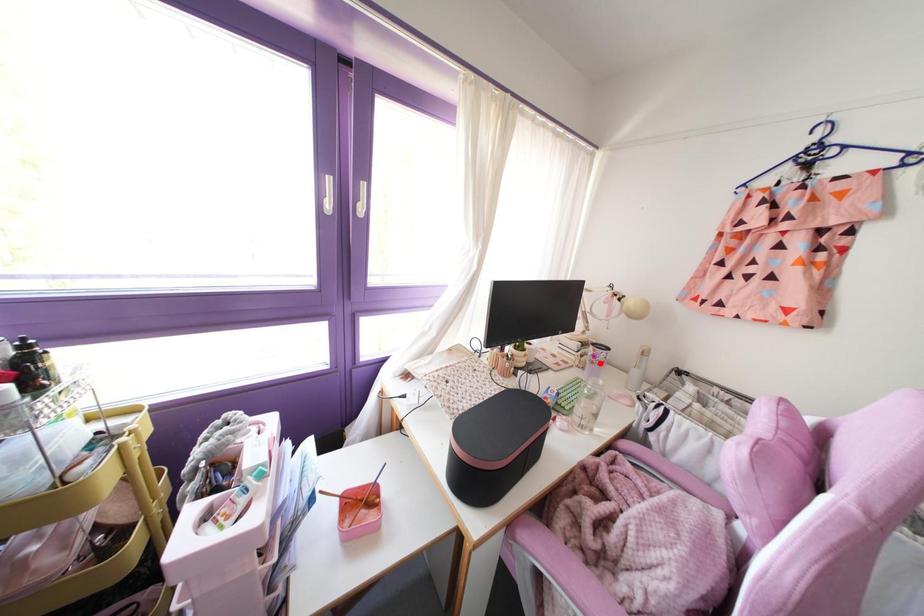
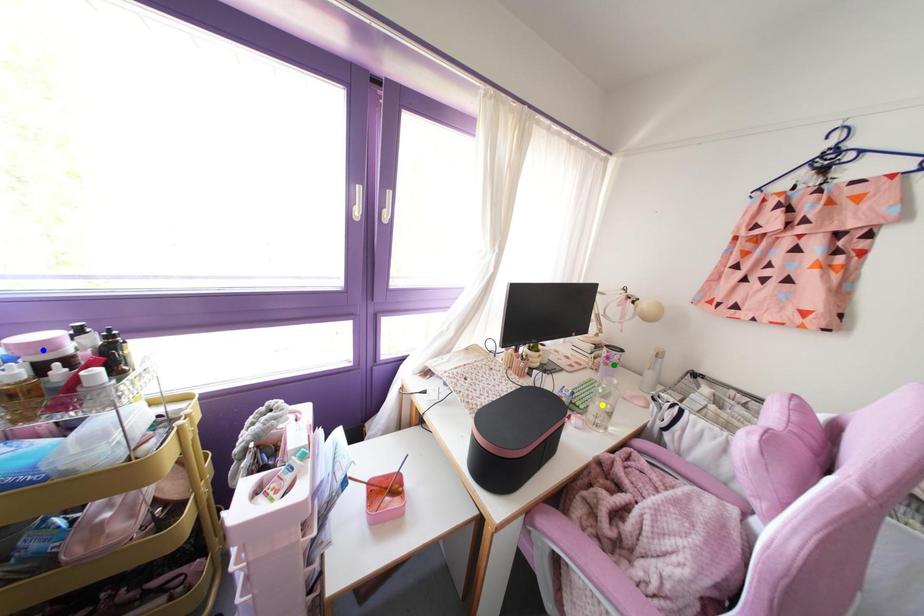
Question: I am providing you with two images of the same scene from different viewpoints. A red point is marked on the first image. You are given multiple points on the second image. Which spot in image 2 lines up with the point in image 1?

Choices:
 (A) blue point
 (B) yellow point
 (C) green point

Answer: (C)